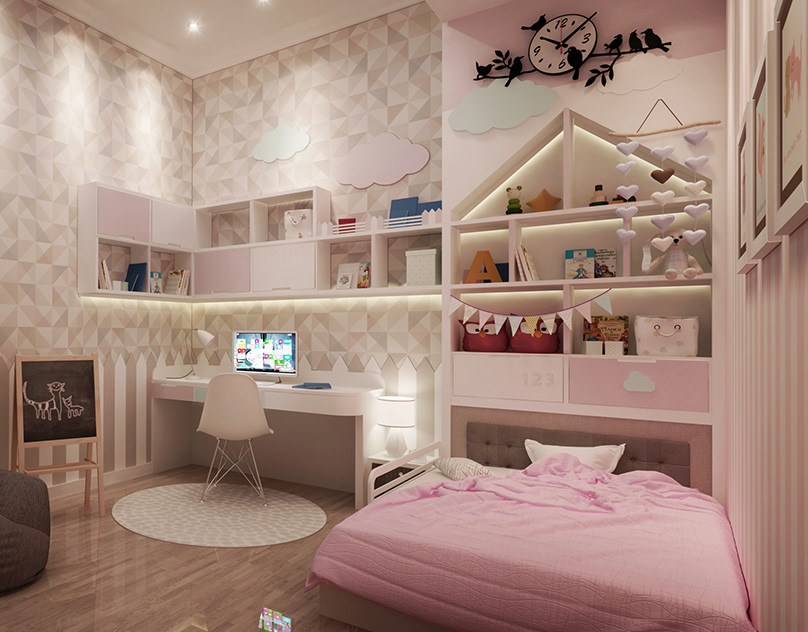
The height and width of the screenshot is (632, 808). Identify the location of white desk. 283,404.